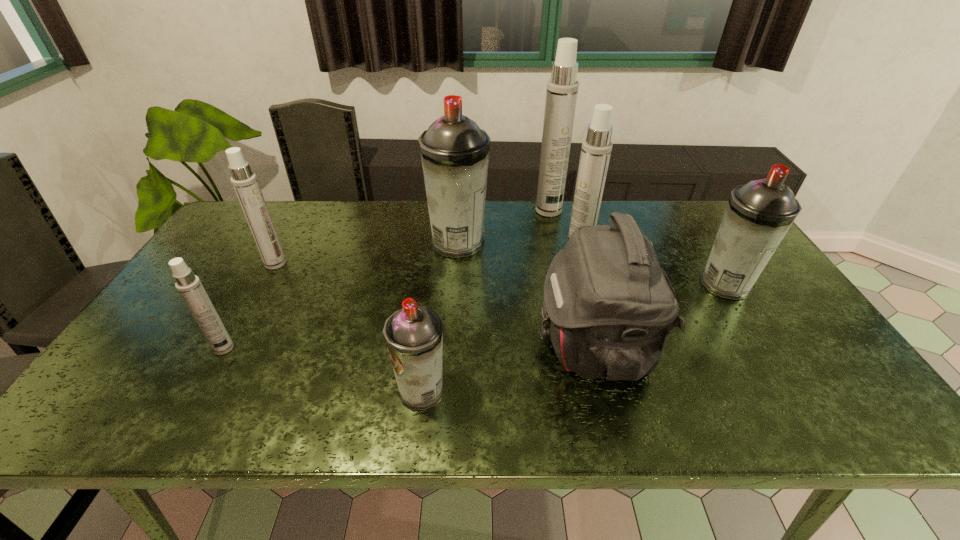
I want to click on white aerosol can identified as the second closest to the third smallest white aerosol can, so click(x=244, y=181).

Point out which white aerosol can is positioned as the second nearest to the smallest white aerosol can. Please provide its 2D coordinates. Your answer should be formatted as a tuple, i.e. [(x, y)], where the tuple contains the x and y coordinates of a point satisfying the conditions above.

[(596, 149)]

Identify which gray aerosol can is located as the nearest to the farthest white aerosol can. Please provide its 2D coordinates. Your answer should be formatted as a tuple, i.e. [(x, y)], where the tuple contains the x and y coordinates of a point satisfying the conditions above.

[(454, 151)]

Select which gray aerosol can is the second closest to the third biggest white aerosol can. Please provide its 2D coordinates. Your answer should be formatted as a tuple, i.e. [(x, y)], where the tuple contains the x and y coordinates of a point satisfying the conditions above.

[(414, 334)]

The height and width of the screenshot is (540, 960). I want to click on vacant position in the image that satisfies the following two spatial constraints: 1. on the front side of the smallest gray aerosol can; 2. on the left side of the third biggest white aerosol can, so click(x=205, y=391).

Where is `free location that satisfies the following two spatial constraints: 1. on the front side of the third smallest white aerosol can; 2. on the right side of the biggest gray aerosol can`? Image resolution: width=960 pixels, height=540 pixels. free location that satisfies the following two spatial constraints: 1. on the front side of the third smallest white aerosol can; 2. on the right side of the biggest gray aerosol can is located at coordinates (458, 254).

The height and width of the screenshot is (540, 960). Find the location of `free space that satisfies the following two spatial constraints: 1. on the back side of the second biggest white aerosol can; 2. on the right side of the smallest gray aerosol can`. free space that satisfies the following two spatial constraints: 1. on the back side of the second biggest white aerosol can; 2. on the right side of the smallest gray aerosol can is located at coordinates (438, 254).